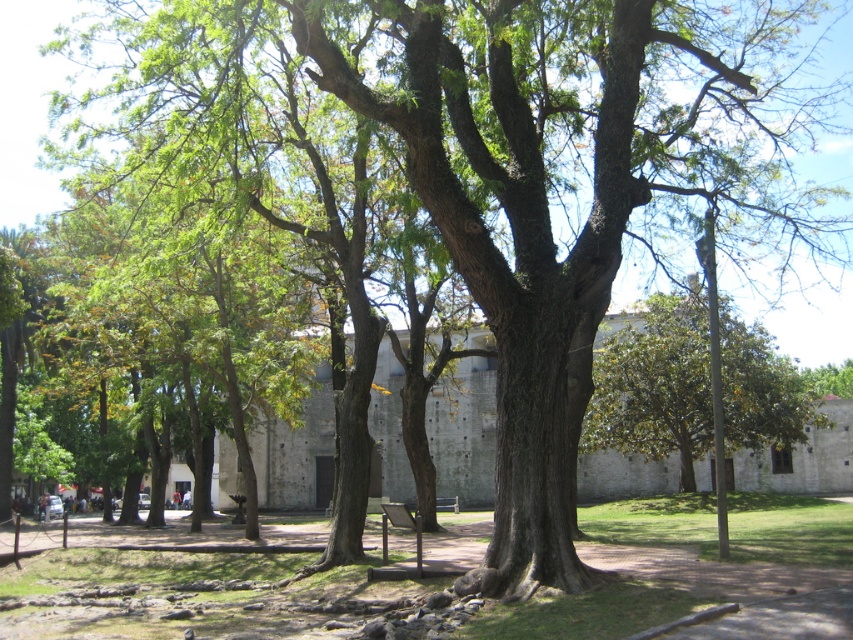
Can you confirm if brown rough tree at center is shorter than green leafy tree at center?

Yes, brown rough tree at center is shorter than green leafy tree at center.

Image resolution: width=853 pixels, height=640 pixels. I want to click on brown rough tree at center, so click(x=691, y=573).

Between point (672, 579) and point (679, 301), which one is positioned in front?

Point (672, 579) is more forward.

At what (x,y) coordinates should I click in order to perform the action: click on brown rough tree at center. Please return your answer as a coordinate pair (x, y). Looking at the image, I should click on (691, 573).